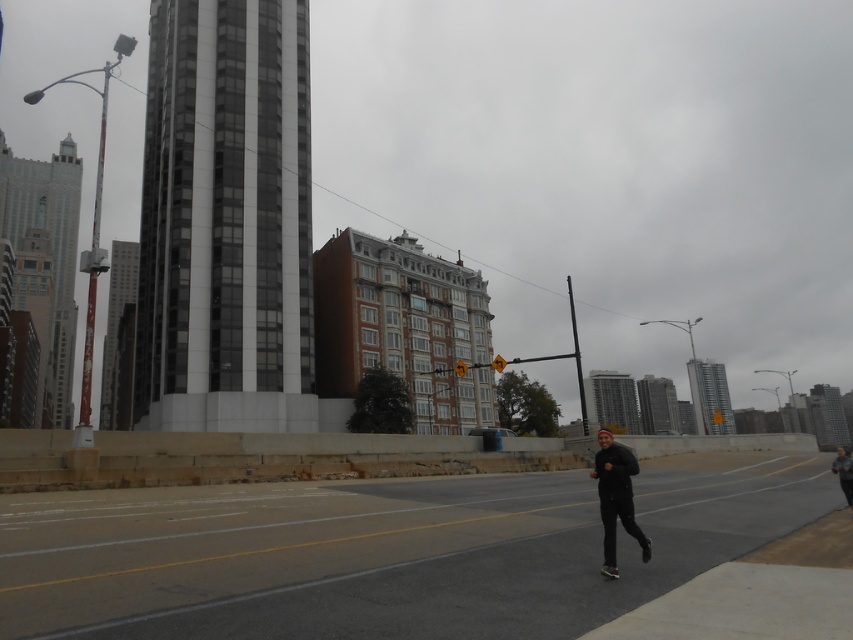
You are a drone operator planning to fly a drone from the black asphalt highway at center to the dark gray concrete building at upper right. The drone has a maximum flight range of 500 feet. Based on the scene, can the drone reach its destination without needing to recharge?

The black asphalt highway at center and dark gray concrete building at upper right are 506.17 feet apart from each other. Since the drone can only fly 500 feet before needing to recharge, it cannot reach the dark gray concrete building at upper right without recharging.

Looking at this image, you are an architect analyzing the urban skyline. Which of the two skyscrapers, the white glass skyscraper at upper left or the glassy silver skyscraper at right, has a smaller width?

The white glass skyscraper at upper left has a smaller width than the glassy silver skyscraper at right.